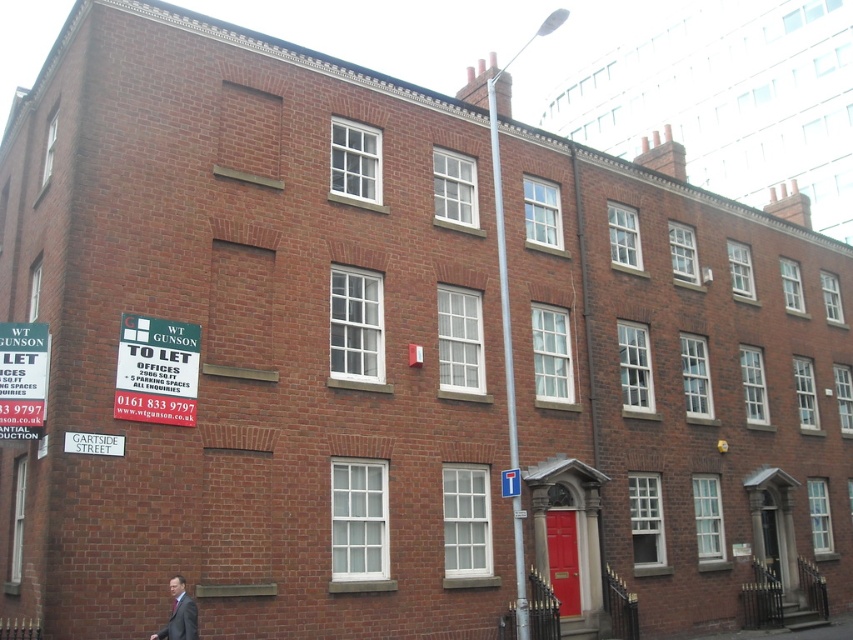
You are standing in front of the building and want to touch both points marked on the wall. Which point should you reach for first, the point at coordinate (x=184, y=416) or the point at (x=102, y=444)?

You should reach for the point at coordinate (x=102, y=444) first because it is closer to you than the point at (x=184, y=416), which is further away.

You are standing in front of the building and want to read the green plastic signboard at upper left. Can you read it clearly without moving closer?

The green plastic signboard at upper left is 29.98 meters away from camera, so you cannot read it clearly without moving closer.

You are standing in front of the building and notice two points marked on its facade. The first point is at coordinates point (10,323) and the second is at point (192,612). Which point is closer to you?

Point (10,323) is further to the camera than point (192,612), so the point closer to you is point (192,612).